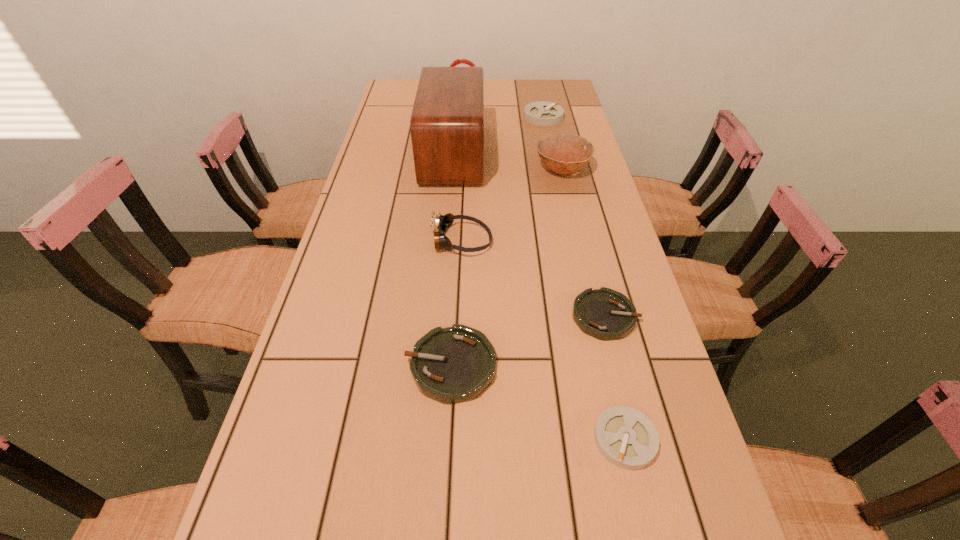
Locate an element on the screen. The height and width of the screenshot is (540, 960). free space located 0.340m on the back of the nearer gray ashtray is located at coordinates (588, 278).

At what (x,y) coordinates should I click in order to perform the action: click on vacant space located on the front of the smaller green ashtray. Please return your answer as a coordinate pair (x, y). The width and height of the screenshot is (960, 540). Looking at the image, I should click on (624, 393).

Where is `object at the far edge`? object at the far edge is located at coordinates (457, 61).

Locate an element on the screen. bowl at the right edge is located at coordinates (562, 153).

Identify the location of vacant area at the far edge of the desktop. The height and width of the screenshot is (540, 960). (504, 97).

Find the location of `free location at the left edge`. free location at the left edge is located at coordinates (323, 357).

Identify the location of vacant space at the right edge of the desktop. The width and height of the screenshot is (960, 540). (547, 131).

Where is `free region at the far left corner`? The height and width of the screenshot is (540, 960). free region at the far left corner is located at coordinates (413, 82).

Find the location of a particular element. free space between the fifth shortest object and the smaller green ashtray is located at coordinates (533, 278).

Where is `vacant point located between the bronze goggles and the third tallest object`? vacant point located between the bronze goggles and the third tallest object is located at coordinates (512, 205).